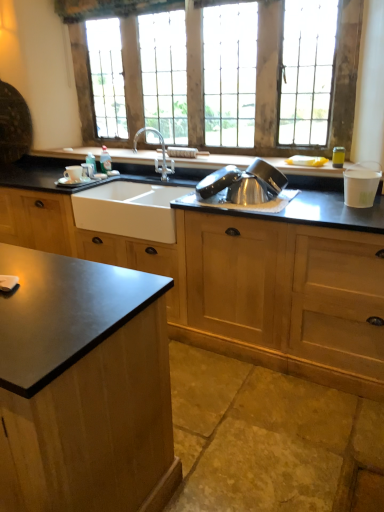
Question: From the image's perspective, is wooden window at upper center located above or below matte white cup at sink?

Choices:
 (A) above
 (B) below

Answer: (A)

Question: Considering the positions of wooden window at upper center and matte white cup at sink in the image, is wooden window at upper center wider or thinner than matte white cup at sink?

Choices:
 (A) thin
 (B) wide

Answer: (A)

Question: Based on their relative distances, which object is farther from the white matte sink at center?

Choices:
 (A) satin silver bowl at center, acting as the 2th appliance starting from the right
 (B) wooden window at upper center
 (C) yellow plastic coffee maker at right
 (D) white paper cup at right, which is counted as the 2th appliance, starting from the left
 (E) silver metallic faucet at center

Answer: (C)

Question: Which object is the closest to the wooden window at upper center?

Choices:
 (A) clear plastic bottle at sink left
 (B) matte white cup at sink
 (C) white paper cup at right, which is counted as the 2th appliance, starting from the left
 (D) yellow plastic coffee maker at right
 (E) satin silver bowl at center, marked as the first appliance in a left-to-right arrangement

Answer: (D)